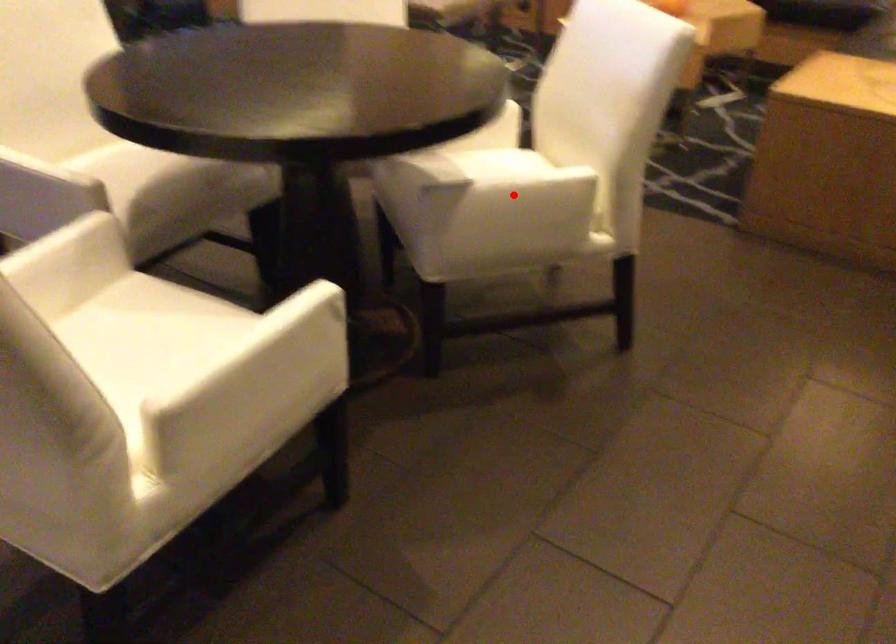
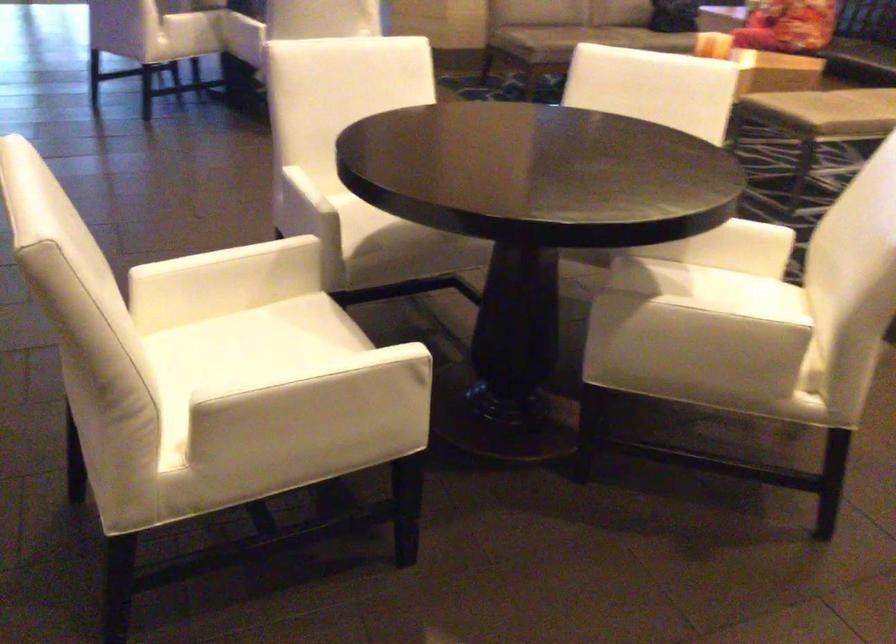
In the second image, find the point that corresponds to the highlighted location in the first image.

(699, 319)